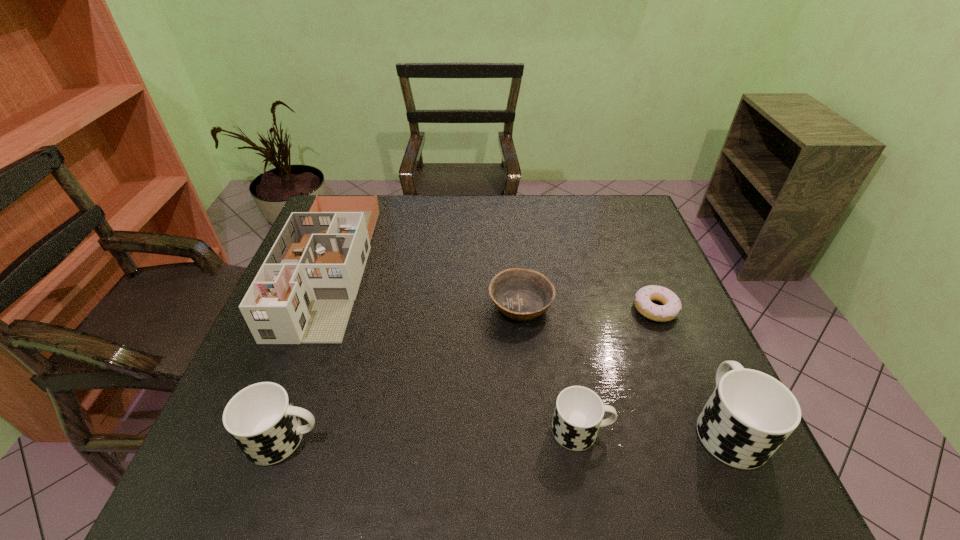
Locate an element on the screen. The height and width of the screenshot is (540, 960). object that is at the far left corner is located at coordinates (304, 291).

Identify the location of object present at the near left corner. (261, 419).

Find the location of a particular element. object present at the near right corner is located at coordinates (749, 415).

I want to click on vacant area at the far edge of the desktop, so click(563, 209).

Locate an element on the screen. This screenshot has height=540, width=960. vacant position at the near edge of the desktop is located at coordinates (362, 417).

You are a GUI agent. You are given a task and a screenshot of the screen. Output one action in this format:
    pyautogui.click(x=<x>, y=<y>)
    Task: Click on the vacant area at the right edge of the desktop
    
    Given the screenshot: What is the action you would take?
    (x=670, y=322)

At what (x,y) coordinates should I click in order to perform the action: click on free space between the shortest cup and the second tallest cup. Please return your answer as a coordinate pair (x, y). Image resolution: width=960 pixels, height=540 pixels. Looking at the image, I should click on (433, 435).

The height and width of the screenshot is (540, 960). I want to click on unoccupied area between the second cup from left to right and the doughnut, so click(x=618, y=369).

Locate an element on the screen. This screenshot has height=540, width=960. free space between the shortest object and the fifth tallest object is located at coordinates click(588, 307).

Where is `free space between the bowl and the leftmost cup`? free space between the bowl and the leftmost cup is located at coordinates (402, 372).